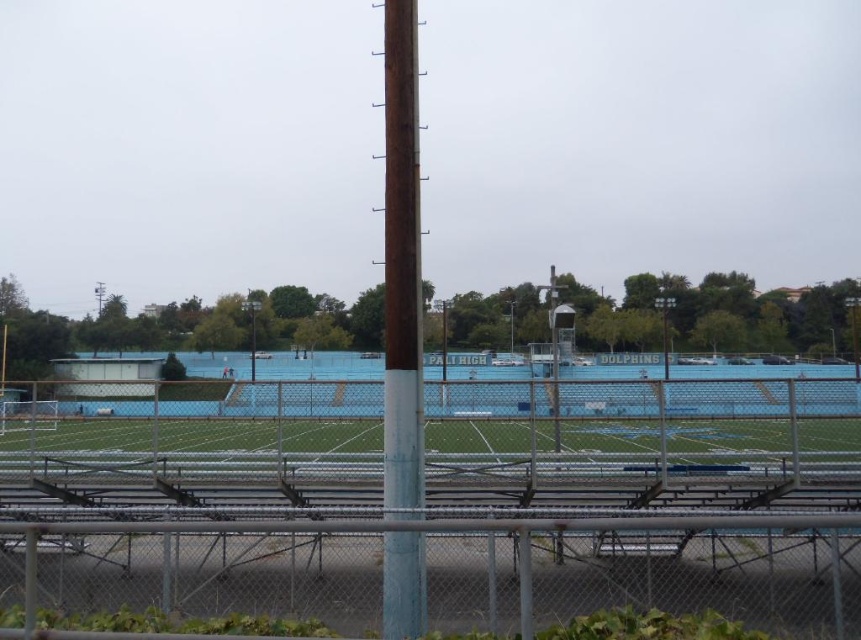
Question: Does metallic chain-link fence at center appear over rusty wood pole at center?

Choices:
 (A) yes
 (B) no

Answer: (B)

Question: Is metallic chain-link fence at center above rusty wood pole at center?

Choices:
 (A) no
 (B) yes

Answer: (A)

Question: Which point is farther to the camera?

Choices:
 (A) rusty wood pole at center
 (B) metallic chain-link fence at center

Answer: (A)

Question: Is metallic chain-link fence at center behind rusty wood pole at center?

Choices:
 (A) no
 (B) yes

Answer: (A)

Question: Among these points, which one is farthest from the camera?

Choices:
 (A) (116, 432)
 (B) (409, 209)

Answer: (A)